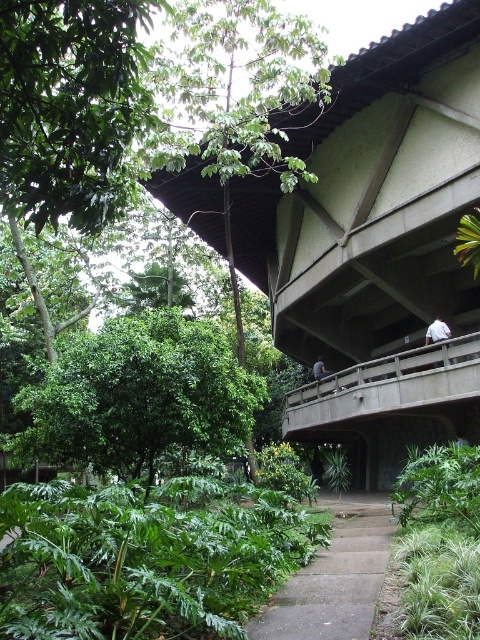
Question: Does green leafy tree at center lie in front of concrete gray bridge at center?

Choices:
 (A) yes
 (B) no

Answer: (A)

Question: Is white fabric shirt at upper right smaller than dark gray fabric at upper center?

Choices:
 (A) yes
 (B) no

Answer: (A)

Question: Which is nearer to the green leafy tree at upper center?

Choices:
 (A) concrete gray bridge at center
 (B) white fabric shirt at upper right
 (C) gray concrete path at center
 (D) green leafy tree at center

Answer: (D)

Question: Is green leafy tree at upper center below concrete gray bridge at center?

Choices:
 (A) no
 (B) yes

Answer: (A)

Question: Which point is farther to the camera?

Choices:
 (A) dark gray fabric at upper center
 (B) white fabric shirt at upper right
 (C) green leafy tree at upper center

Answer: (A)

Question: Estimate the real-world distances between objects in this image. Which object is farther from the white fabric shirt at upper right?

Choices:
 (A) gray concrete path at center
 (B) concrete gray bridge at center
 (C) green leafy tree at upper center

Answer: (C)